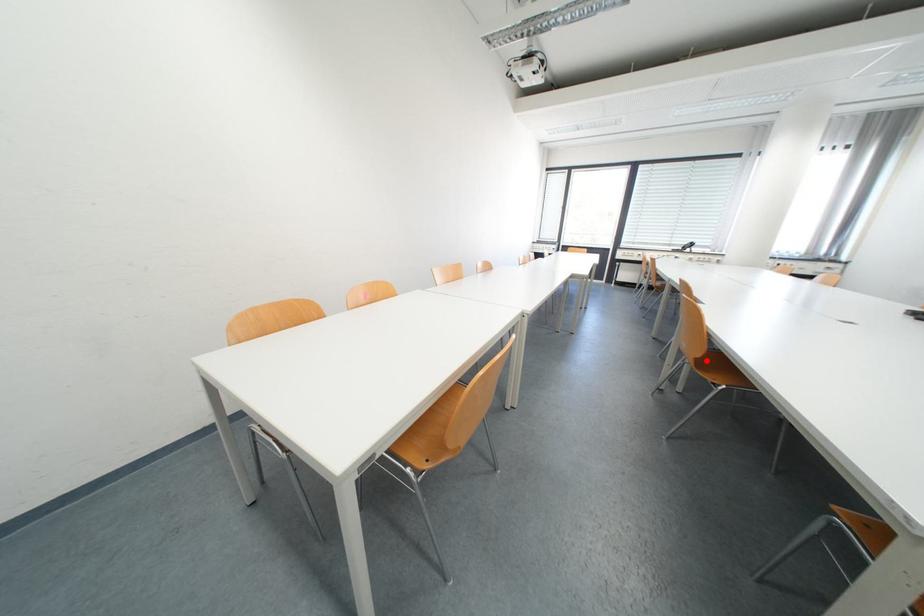
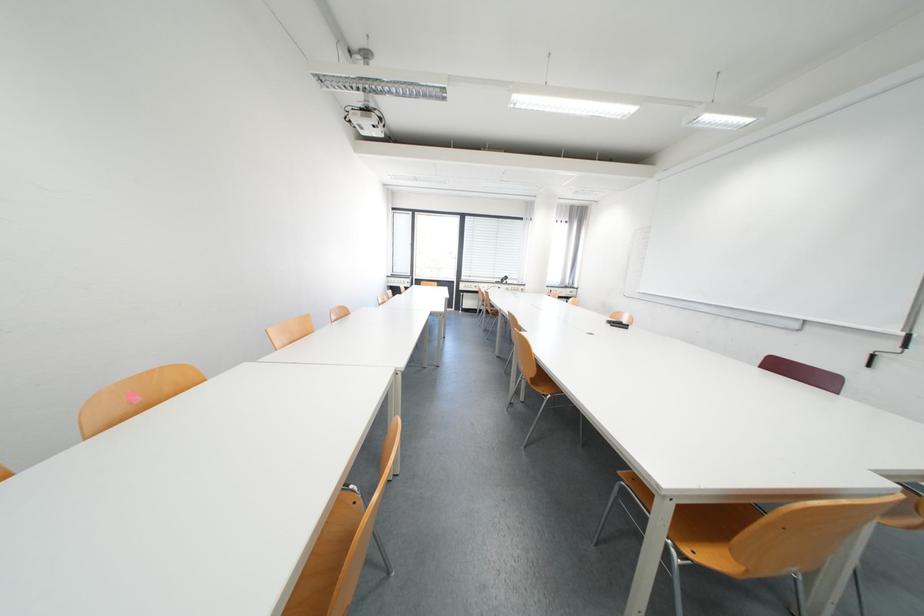
Where in the second image is the point corresponding to the highlighted location from the first image?

(541, 379)